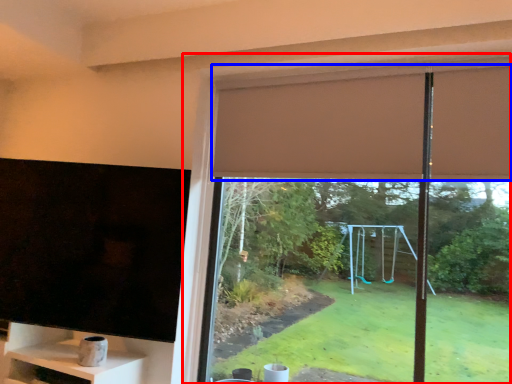
Question: Which object is closer to the camera taking this photo, window (highlighted by a red box) or curtain (highlighted by a blue box)?

Choices:
 (A) window
 (B) curtain

Answer: (A)